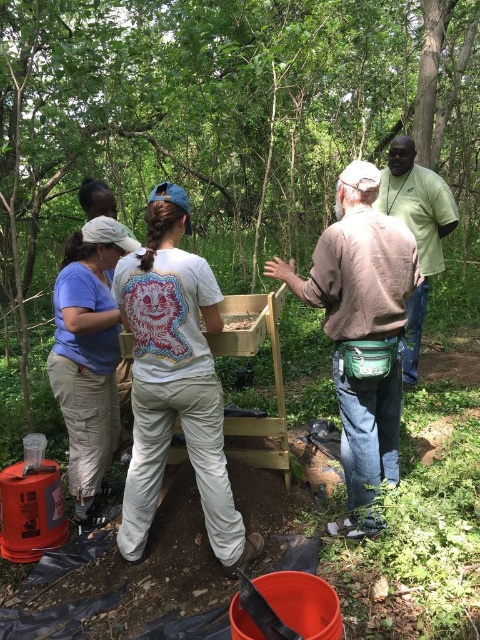
Can you confirm if green wood tree at center is thinner than brown leather belt at center?

Indeed, green wood tree at center has a lesser width compared to brown leather belt at center.

At what (x,y) coordinates should I click in order to perform the action: click on green wood tree at center. Please return your answer as a coordinate pair (x, y). The width and height of the screenshot is (480, 640). Looking at the image, I should click on (215, 120).

Can you confirm if white cotton shirt at center is positioned to the right of brown leather belt at center?

In fact, white cotton shirt at center is to the left of brown leather belt at center.

Does point (168, 346) come behind point (360, 472)?

No.

What do you see at coordinates (175, 381) in the screenshot? The height and width of the screenshot is (640, 480). I see `white cotton shirt at center` at bounding box center [175, 381].

Identify the location of white cotton shirt at center. This screenshot has width=480, height=640. (175, 381).

Can you confirm if brown leather belt at center is shorter than matte wooden box at center?

No, brown leather belt at center is not shorter than matte wooden box at center.

Is point (393, 355) positioned in front of point (239, 321)?

Yes, point (393, 355) is in front of point (239, 321).

Is point (344, 529) positioned in front of point (228, 326)?

Yes.

Find the location of `brown leather belt at center`. brown leather belt at center is located at coordinates click(361, 330).